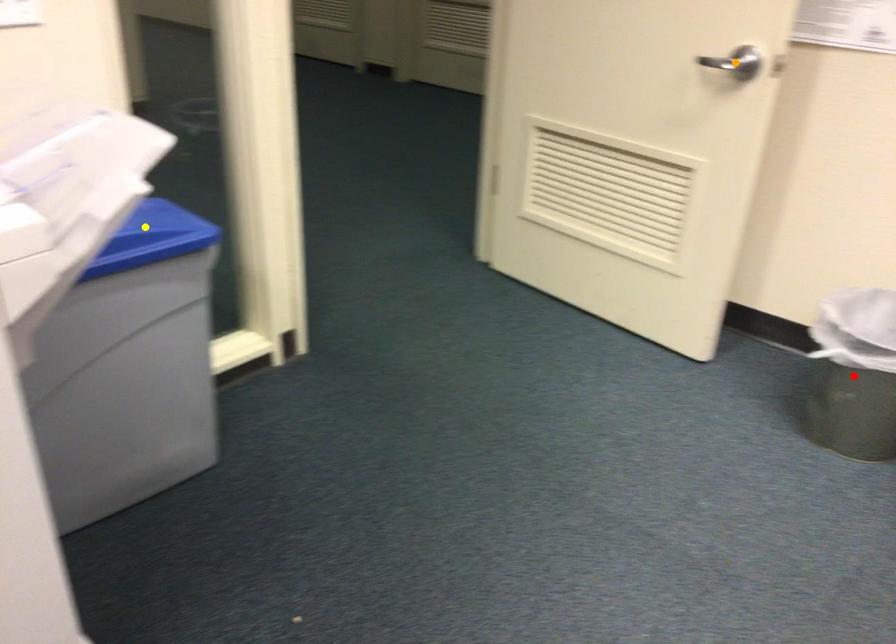
Order these from farthest to nearest:
1. yellow point
2. orange point
3. red point

orange point
red point
yellow point